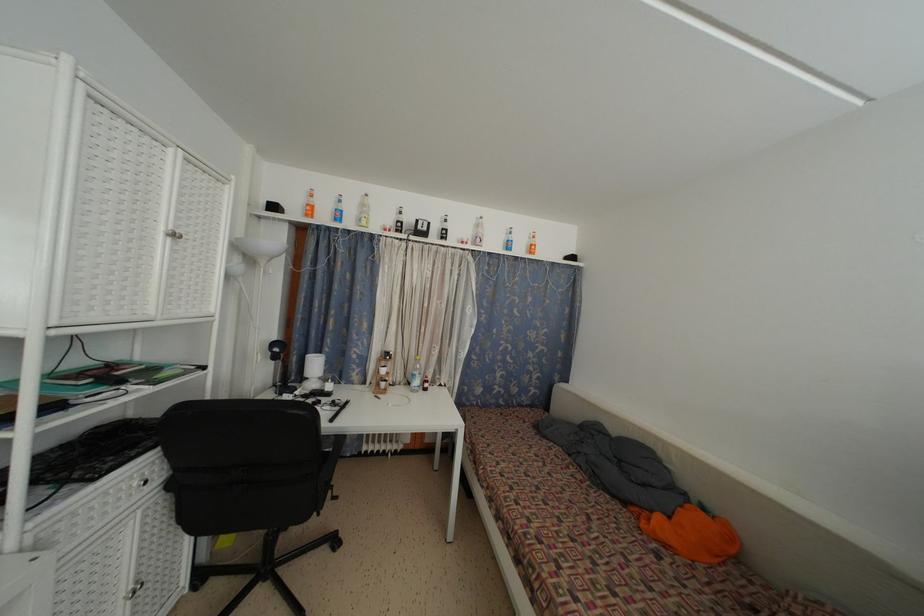
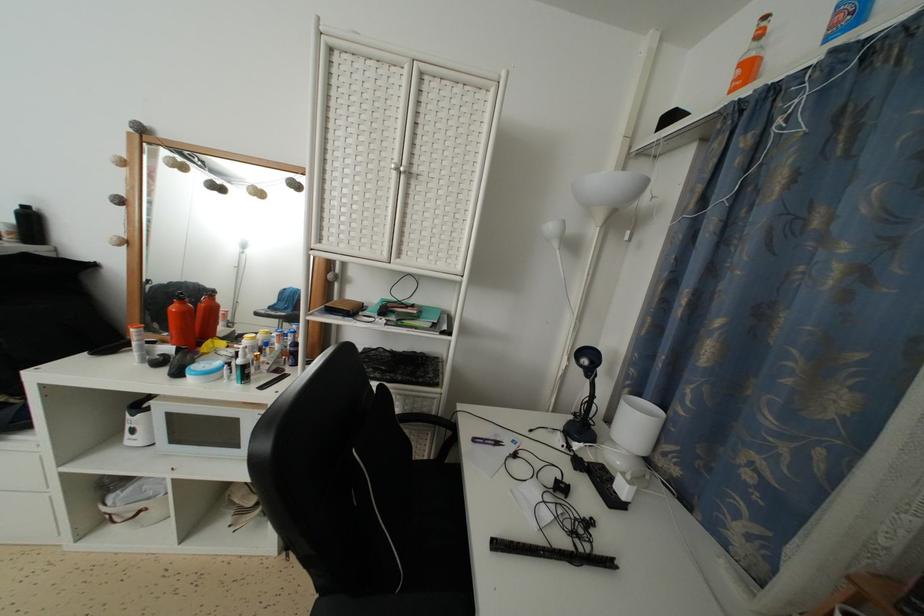
The point at (351, 408) is marked in the first image. Where is the corresponding point in the second image?

(614, 569)